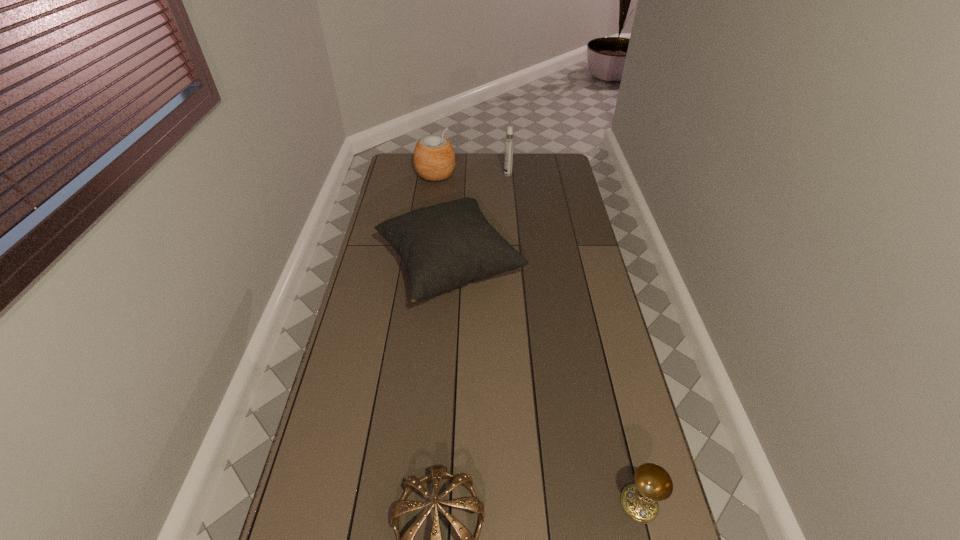
Where is `coconut`? The height and width of the screenshot is (540, 960). coconut is located at coordinates (434, 159).

Where is `aerosol can`? This screenshot has width=960, height=540. aerosol can is located at coordinates (509, 139).

Where is `the third nearest object`? The height and width of the screenshot is (540, 960). the third nearest object is located at coordinates pos(447,245).

Find the location of a particular element. Image resolution: width=960 pixels, height=540 pixels. chalice is located at coordinates (653, 483).

This screenshot has height=540, width=960. Identify the location of vacant region located 0.160m on the front of the coconut. (432, 204).

Identify the location of free space located on the front of the aerosol can. (511, 208).

The height and width of the screenshot is (540, 960). Identify the location of vacant region located 0.150m on the back of the third nearest object. (454, 203).

Identify the location of vacant region located 0.070m on the left of the rightmost object. Image resolution: width=960 pixels, height=540 pixels. (592, 504).

You are a GUI agent. You are given a task and a screenshot of the screen. Output one action in this format:
    pyautogui.click(x=<x>, y=<y>)
    Task: Click on the coconut that is at the far edge
    This screenshot has height=540, width=960.
    Given the screenshot: What is the action you would take?
    pyautogui.click(x=434, y=159)

Where is `aerosol can at the far edge`? aerosol can at the far edge is located at coordinates (509, 139).